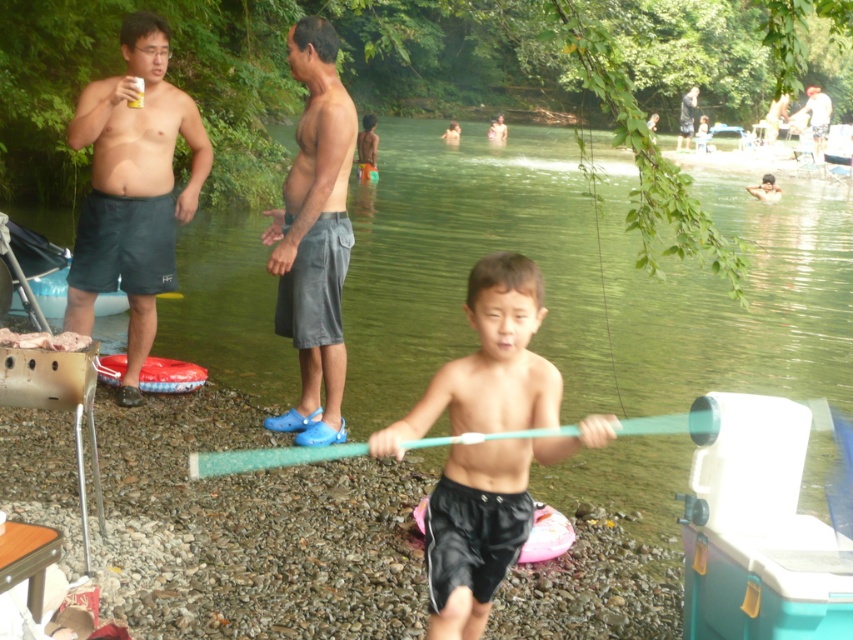
Is black matte shorts at center positioned before gray fabric shorts at center?

Yes, black matte shorts at center is closer to the viewer.

Is point (502, 460) farther from viewer compared to point (341, 355)?

That is False.

Which is behind, point (445, 636) or point (328, 64)?

The point (328, 64) is more distant.

Locate an element on the screen. black matte shorts at center is located at coordinates (485, 522).

Is matte black shorts at left above light brown wooden stick at center?

Incorrect, matte black shorts at left is not positioned above light brown wooden stick at center.

Does point (137, 134) come behind point (819, 131)?

No.

You are a GUI agent. You are given a task and a screenshot of the screen. Output one action in this format:
    pyautogui.click(x=<x>, y=<y>)
    Task: Click on the matte black shorts at left
    The image size is (853, 640).
    Given the screenshot: What is the action you would take?
    pyautogui.click(x=132, y=188)

This screenshot has height=640, width=853. What do you see at coordinates (466, 262) in the screenshot?
I see `green translucent stick at center` at bounding box center [466, 262].

Identify the location of green translucent stick at center. (466, 262).

The image size is (853, 640). Describe the element at coordinates (466, 262) in the screenshot. I see `green translucent stick at center` at that location.

Find the location of `green translucent stick at center`. green translucent stick at center is located at coordinates (466, 262).